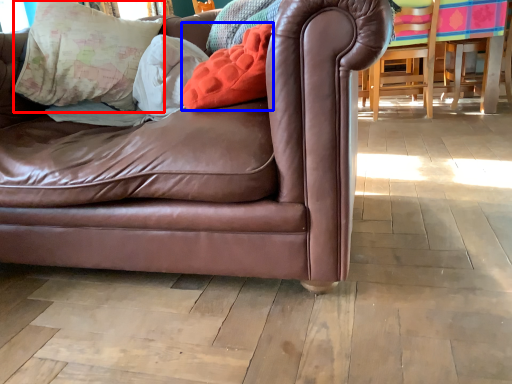
Question: Which of the following is the closest to the observer, pillow (highlighted by a red box) or pillow (highlighted by a blue box)?

Choices:
 (A) pillow
 (B) pillow

Answer: (B)